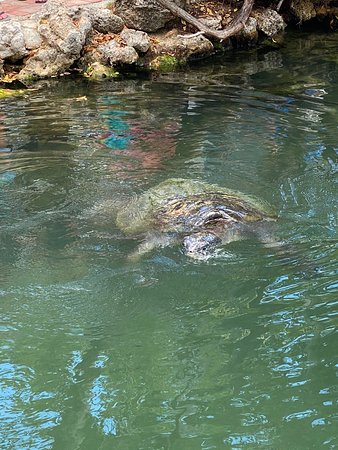
Where is `tiles`? tiles is located at coordinates (18, 6), (75, 2).